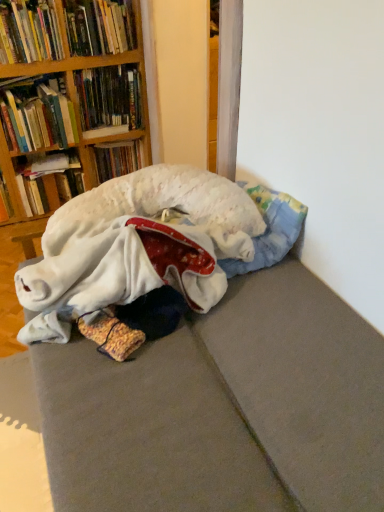
Question: From a real-world perspective, is hardcover book at upper left, the fourth book from the bottom, beneath hardcover book at upper left, placed as the sixth book when sorted from bottom to top?

Choices:
 (A) no
 (B) yes

Answer: (B)

Question: Is hardcover book at upper left, the fourth book when ordered from top to bottom, at the right side of hardcover book at upper left, placed as the sixth book when sorted from bottom to top?

Choices:
 (A) yes
 (B) no

Answer: (B)

Question: From a real-world perspective, is hardcover book at upper left, the fourth book from the bottom, located higher than hardcover book at upper left, placed as the sixth book when sorted from bottom to top?

Choices:
 (A) no
 (B) yes

Answer: (A)

Question: Would you consider hardcover book at upper left, the fourth book when ordered from top to bottom, to be distant from hardcover book at upper left, placed as the sixth book when sorted from bottom to top?

Choices:
 (A) no
 (B) yes

Answer: (A)

Question: Is hardcover book at upper left, the fourth book from the bottom, positioned with its back to hardcover book at upper left, marked as the 2th book in a top-to-bottom arrangement?

Choices:
 (A) no
 (B) yes

Answer: (A)

Question: Considering the relative sizes of hardcover book at upper left, the fourth book when ordered from top to bottom, and hardcover book at upper left, placed as the sixth book when sorted from bottom to top, in the image provided, is hardcover book at upper left, the fourth book when ordered from top to bottom, wider than hardcover book at upper left, placed as the sixth book when sorted from bottom to top,?

Choices:
 (A) yes
 (B) no

Answer: (A)

Question: Is hardcover book at upper left, the fourth book from the bottom, thinner than hardcover book at upper left, the fifth book positioned from the top?

Choices:
 (A) yes
 (B) no

Answer: (B)

Question: Considering the relative sizes of hardcover book at upper left, the fourth book from the bottom, and hardcover book at upper left, the fifth book positioned from the top, in the image provided, is hardcover book at upper left, the fourth book from the bottom, smaller than hardcover book at upper left, the fifth book positioned from the top,?

Choices:
 (A) no
 (B) yes

Answer: (A)

Question: Is hardcover book at upper left, the fourth book from the bottom, facing away from hardcover book at upper left, the fifth book positioned from the top?

Choices:
 (A) yes
 (B) no

Answer: (B)

Question: Is the position of hardcover book at upper left, the fourth book when ordered from top to bottom, more distant than that of hardcover book at upper left, which ranks as the third book in bottom-to-top order?

Choices:
 (A) yes
 (B) no

Answer: (B)

Question: Is hardcover book at upper left, the fourth book when ordered from top to bottom, to the left of hardcover book at upper left, the fifth book positioned from the top, from the viewer's perspective?

Choices:
 (A) no
 (B) yes

Answer: (B)

Question: From the image's perspective, is hardcover book at upper left, the fourth book when ordered from top to bottom, below hardcover book at upper left, the fifth book positioned from the top?

Choices:
 (A) no
 (B) yes

Answer: (A)

Question: From the image's perspective, is hardcover book at upper left, the fourth book when ordered from top to bottom, on hardcover book at left, the first book positioned from the bottom?

Choices:
 (A) no
 (B) yes

Answer: (B)